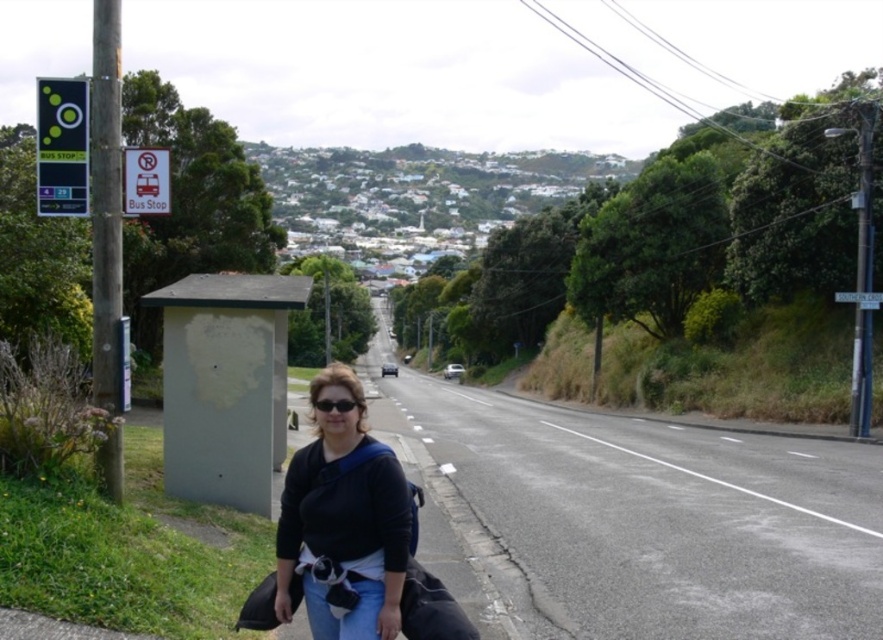
You are a delivery person who needs to place a new package at the exact location of the black fabric bag at center. What coordinates should you use for the package?

The coordinates for the black fabric bag at center are at point (344, 518), so you should place the package at those coordinates.